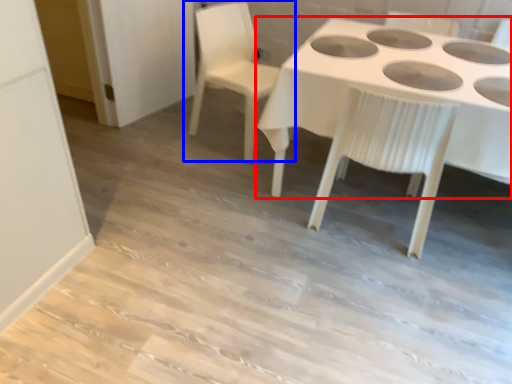
Question: Which of the following is the farthest to the observer, table (highlighted by a red box) or chair (highlighted by a blue box)?

Choices:
 (A) table
 (B) chair

Answer: (B)